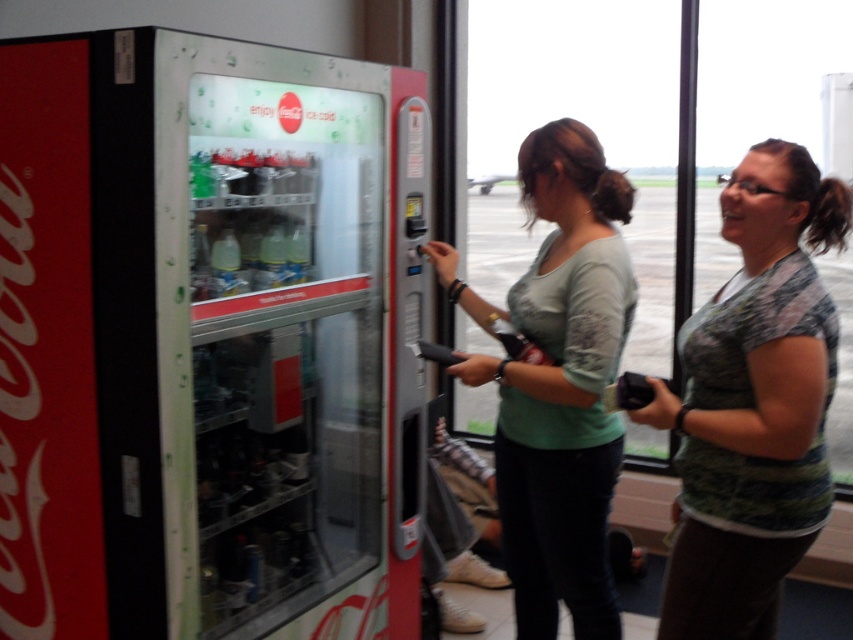
You are standing in front of the vending machine and want to reach the metallic silver vending machine at left and the light green fabric shirt at center. Which object is closer to you?

The metallic silver vending machine at left is closer to you because it is to the left of the light green fabric shirt at center.

You are trying to reach the metallic silver vending machine at left from where you are standing next to the camouflage shirt at center. Is the vending machine to your left or right side?

The metallic silver vending machine at left is positioned on the left side of camouflage shirt at center, so it would be to your left side.